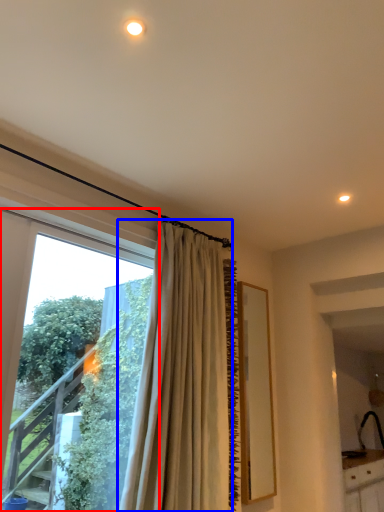
Question: Which object is further to the camera taking this photo, window (highlighted by a red box) or curtain (highlighted by a blue box)?

Choices:
 (A) window
 (B) curtain

Answer: (B)